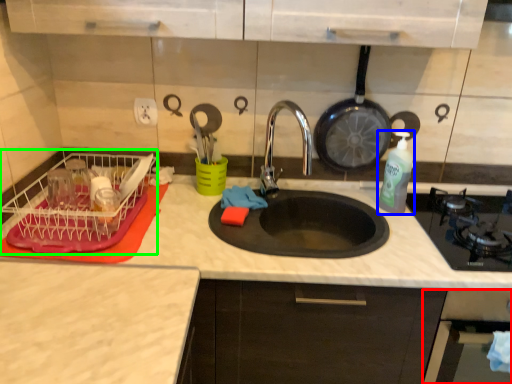
Question: Which object is the farthest from oven (highlighted by a red box)? Choose among these: bottle (highlighted by a blue box) or dish washer (highlighted by a green box).

Choices:
 (A) bottle
 (B) dish washer

Answer: (B)